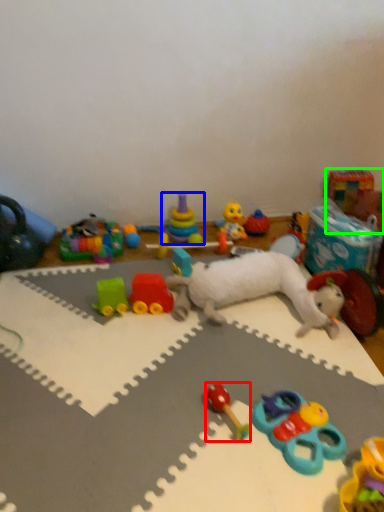
Question: Which object is the farthest from toy (highlighted by a red box)? Choose among these: toy (highlighted by a blue box) or toy (highlighted by a green box).

Choices:
 (A) toy
 (B) toy

Answer: (B)